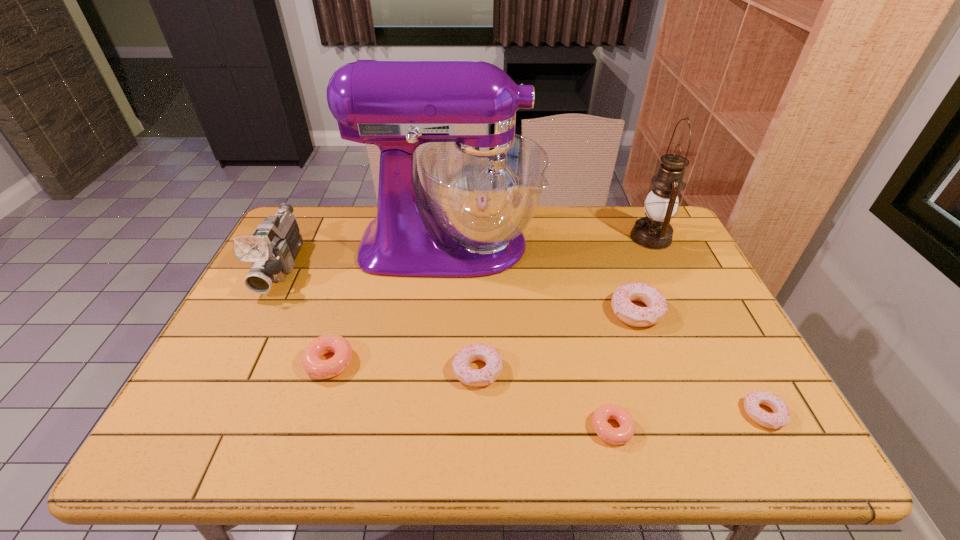
Locate an element on the screen. This screenshot has width=960, height=540. free spot between the brown oil lamp and the tallest object is located at coordinates pyautogui.click(x=550, y=241).

Image resolution: width=960 pixels, height=540 pixels. Find the location of `vacant area that lies between the oil lamp and the fifth object from left to right`. vacant area that lies between the oil lamp and the fifth object from left to right is located at coordinates (632, 333).

You are a GUI agent. You are given a task and a screenshot of the screen. Output one action in this format:
    pyautogui.click(x=<x>, y=<y>)
    Task: Click on the free space between the oil lamp and the third doughnut from right to left
    This screenshot has width=960, height=540.
    Given the screenshot: What is the action you would take?
    pyautogui.click(x=632, y=333)

Where is `free space between the leftmost object and the right pink doughnut`? Image resolution: width=960 pixels, height=540 pixels. free space between the leftmost object and the right pink doughnut is located at coordinates (447, 347).

Where is `free space between the smallest white doughnut and the second tallest object`? free space between the smallest white doughnut and the second tallest object is located at coordinates (708, 326).

The height and width of the screenshot is (540, 960). Identify the location of vacant region between the left pink doughnut and the third tallest object. (306, 314).

Where is `object that is the fourth closest to the oil lamp`? The height and width of the screenshot is (540, 960). object that is the fourth closest to the oil lamp is located at coordinates (617, 436).

Identify which object is the fifth nearest to the third doughnut from right to left. Please provide its 2D coordinates. Your answer should be formatted as a tuple, i.e. [(x, y)], where the tuple contains the x and y coordinates of a point satisfying the conditions above.

[(315, 367)]

Identify which doughnut is located as the third nearest to the bigger pink doughnut. Please provide its 2D coordinates. Your answer should be formatted as a tuple, i.e. [(x, y)], where the tuple contains the x and y coordinates of a point satisfying the conditions above.

[(631, 314)]

Where is `doughnut that can be found as the fourth closest to the fourth object from right to left`? The image size is (960, 540). doughnut that can be found as the fourth closest to the fourth object from right to left is located at coordinates (315, 367).